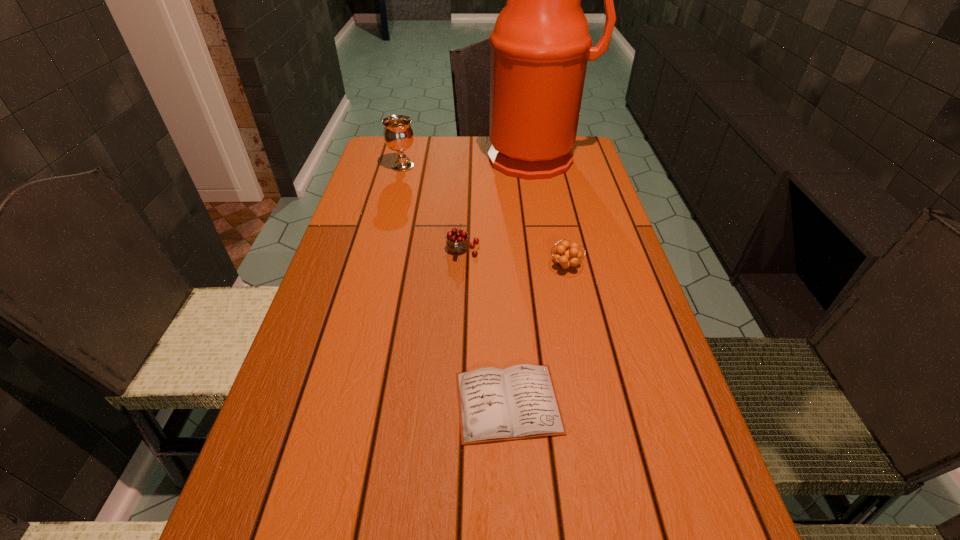
Where is `free space between the tallest object and the orange fruit`? free space between the tallest object and the orange fruit is located at coordinates point(552,212).

Image resolution: width=960 pixels, height=540 pixels. What are the coordinates of `free space between the second tallest object and the orange fruit` in the screenshot? It's located at (484, 216).

Where is `unoccupied position between the fourth shortest object and the tallest object`? unoccupied position between the fourth shortest object and the tallest object is located at coordinates (470, 163).

Where is `vacant area that lies between the tallest object and the fourth tallest object`? vacant area that lies between the tallest object and the fourth tallest object is located at coordinates (552, 212).

Identify which object is the fourth nearest to the water jug. Please provide its 2D coordinates. Your answer should be formatted as a tuple, i.e. [(x, y)], where the tuple contains the x and y coordinates of a point satisfying the conditions above.

[(518, 402)]

Where is `object that is the third nearest to the cherry`? object that is the third nearest to the cherry is located at coordinates (518, 402).

You are a GUI agent. You are given a task and a screenshot of the screen. Output one action in this format:
    pyautogui.click(x=<x>, y=<y>)
    Task: Click on the free location that satisfies the following two spatial constraints: 1. from the spout of the tallest object; 2. on the left side of the second shortest object
    The height and width of the screenshot is (540, 960).
    Given the screenshot: What is the action you would take?
    pyautogui.click(x=559, y=266)

You are a GUI agent. You are given a task and a screenshot of the screen. Output one action in this format:
    pyautogui.click(x=<x>, y=<y>)
    Task: Click on the free space that satisfies the following two spatial constraints: 1. from the spout of the tallest object; 2. on the left side of the orange fruit
    
    Given the screenshot: What is the action you would take?
    pyautogui.click(x=559, y=266)

Where is `free location that satisfies the following two spatial constraints: 1. on the handle side of the second shortest object; 2. on the right side of the cherry`? The image size is (960, 540). free location that satisfies the following two spatial constraints: 1. on the handle side of the second shortest object; 2. on the right side of the cherry is located at coordinates (463, 266).

The width and height of the screenshot is (960, 540). Find the location of `vacant area that satisfies the following two spatial constraints: 1. on the front side of the second shortest object; 2. on the left side of the chalice`. vacant area that satisfies the following two spatial constraints: 1. on the front side of the second shortest object; 2. on the left side of the chalice is located at coordinates (377, 266).